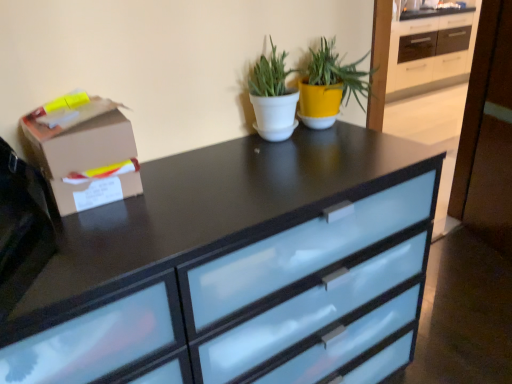
Locate an element on the screen. Image resolution: width=512 pixels, height=384 pixels. vacant region in front of white matte pot at center, which is counted as the first houseplant, starting from the left is located at coordinates (267, 160).